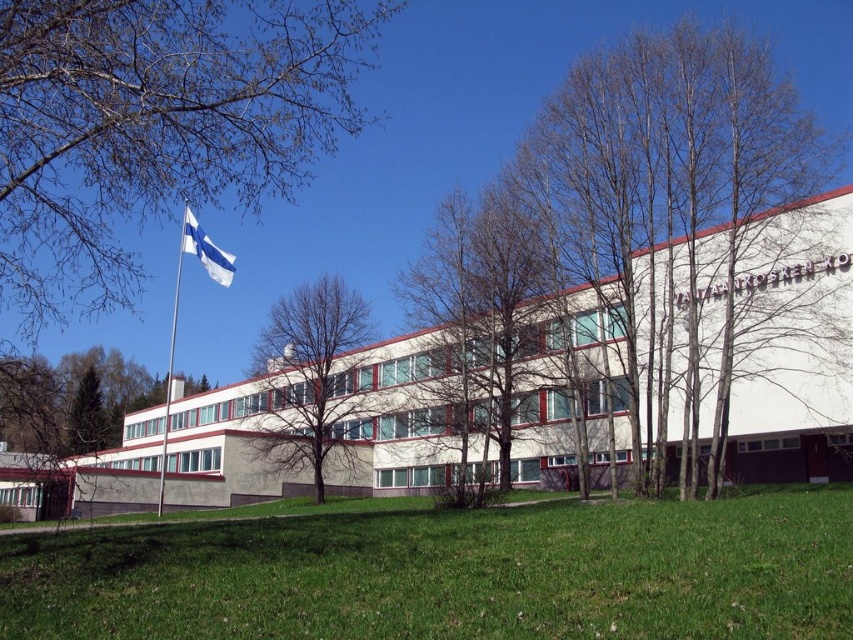
Can you confirm if bare branches at center is positioned to the left of green grass at lower center?

Incorrect, bare branches at center is not on the left side of green grass at lower center.

Is bare branches at center to the right of green grass at lower center from the viewer's perspective?

Yes, bare branches at center is to the right of green grass at lower center.

Between point (792, 243) and point (32, 547), which one is positioned in front?

Point (32, 547)

Where is `bare branches at center`? bare branches at center is located at coordinates tap(643, 253).

Can you confirm if bare branches at upper left is bigger than bare brown tree at center?

Correct, bare branches at upper left is larger in size than bare brown tree at center.

Does bare branches at upper left have a smaller size compared to bare brown tree at center?

Incorrect, bare branches at upper left is not smaller in size than bare brown tree at center.

I want to click on bare branches at upper left, so click(155, 125).

What are the coordinates of `bare branches at upper left` in the screenshot? It's located at (155, 125).

In the scene shown: Is bare branches at center below bare branches at upper left?

Indeed, bare branches at center is positioned under bare branches at upper left.

From the picture: Who is positioned more to the left, bare branches at center or bare branches at upper left?

From the viewer's perspective, bare branches at upper left appears more on the left side.

Who is more forward, (608, 404) or (177, 179)?

Point (177, 179) is more forward.

At what (x,y) coordinates should I click in order to perform the action: click on bare branches at center. Please return your answer as a coordinate pair (x, y). Looking at the image, I should click on (643, 253).